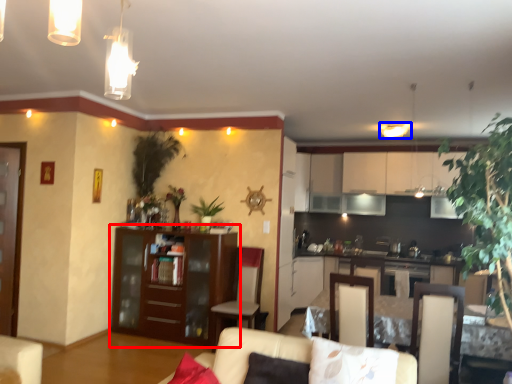
Question: Which object appears closest to the camera in this image, cabinetry (highlighted by a red box) or light fixture (highlighted by a blue box)?

Choices:
 (A) cabinetry
 (B) light fixture

Answer: (A)